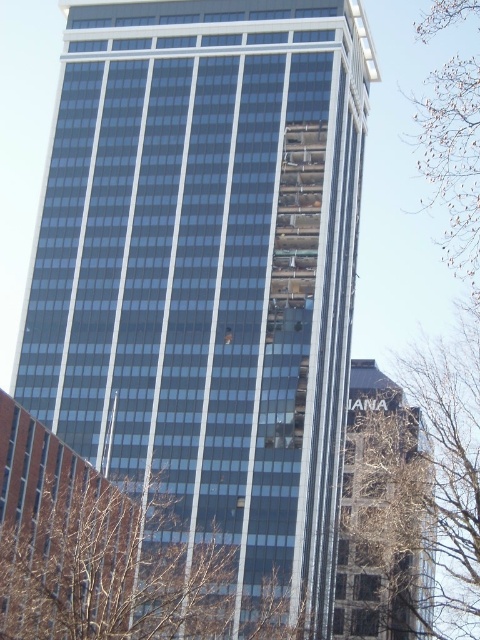
From the picture: You are a construction worker standing at the base of the skyscraper. You need to move a heavy tool from the brown leafy tree at right to the brown leafy tree at upper right. Given that the tool weighs 25 kg and you can carry up to 20 kg, can you carry it directly between them without assistance?

The distance between the brown leafy tree at right and the brown leafy tree at upper right is 20.52 meters. Since you can only carry 25 kg for up to 10 meters, you cannot carry it directly without assistance over this distance.

From the picture: You are standing in front of the skyscraper and notice two brown leafy trees in the image. Which tree, the brown leafy tree at right or the brown leafy tree at upper right, is positioned lower in the scene?

The brown leafy tree at right is positioned lower in the scene because it is below the brown leafy tree at upper right.

You are standing in front of the skyscraper and notice two trees in the image. The first is brown leafless branches at lower center, and the second is brown leafy tree at upper right. Which of these two trees is taller?

The brown leafless branches at lower center has a lesser height compared to brown leafy tree at upper right, so the brown leafy tree at upper right is taller.